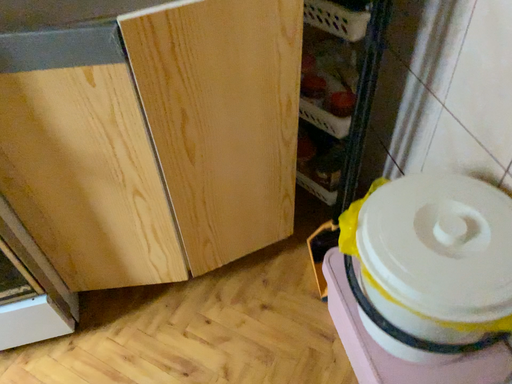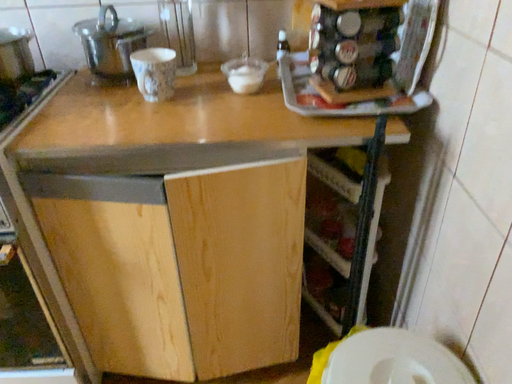
Question: How did the camera likely rotate when shooting the video?

Choices:
 (A) rotated upward
 (B) rotated downward

Answer: (A)